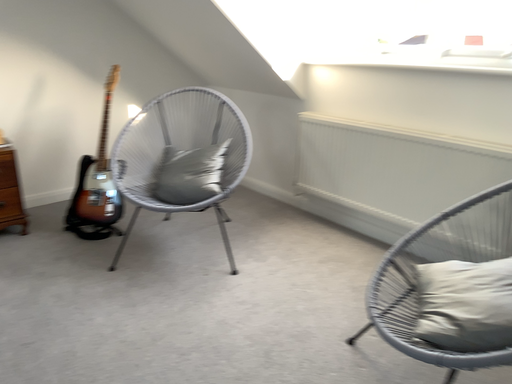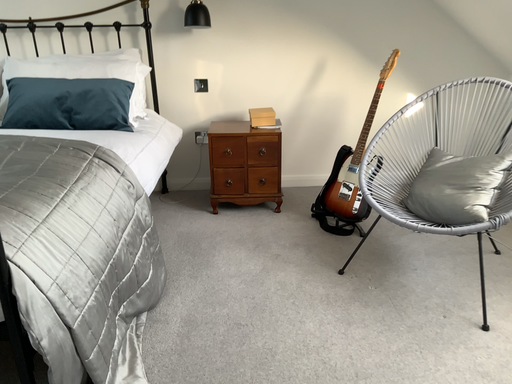
Question: Which way did the camera rotate in the video?

Choices:
 (A) rotated right
 (B) rotated left

Answer: (B)